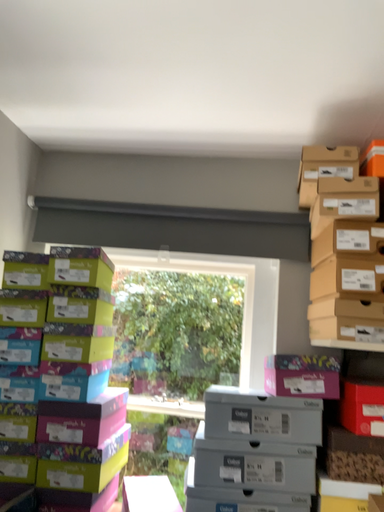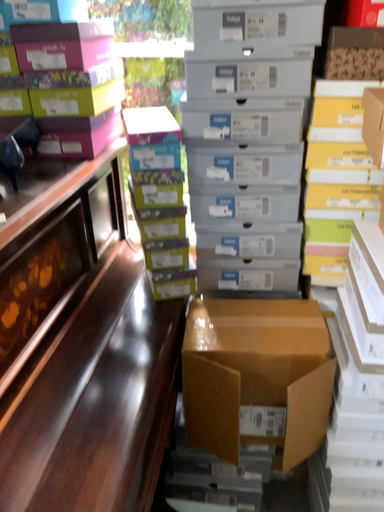
Question: How did the camera likely rotate when shooting the video?

Choices:
 (A) rotated upward
 (B) rotated downward

Answer: (B)